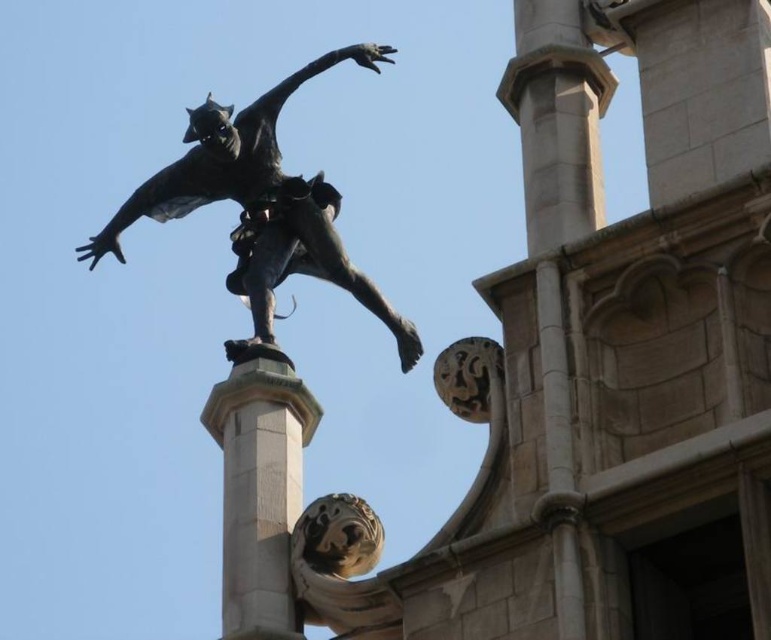
Question: Which point is closer to the camera taking this photo?

Choices:
 (A) (247, 408)
 (B) (98, 256)

Answer: (A)

Question: Does bronze statue at upper center appear on the left side of smooth stone pillar at center?

Choices:
 (A) yes
 (B) no

Answer: (B)

Question: Where is bronze statue at upper center located in relation to smooth stone pillar at center in the image?

Choices:
 (A) below
 (B) above

Answer: (B)

Question: Is the position of bronze statue at upper center more distant than that of smooth stone pillar at center?

Choices:
 (A) yes
 (B) no

Answer: (A)